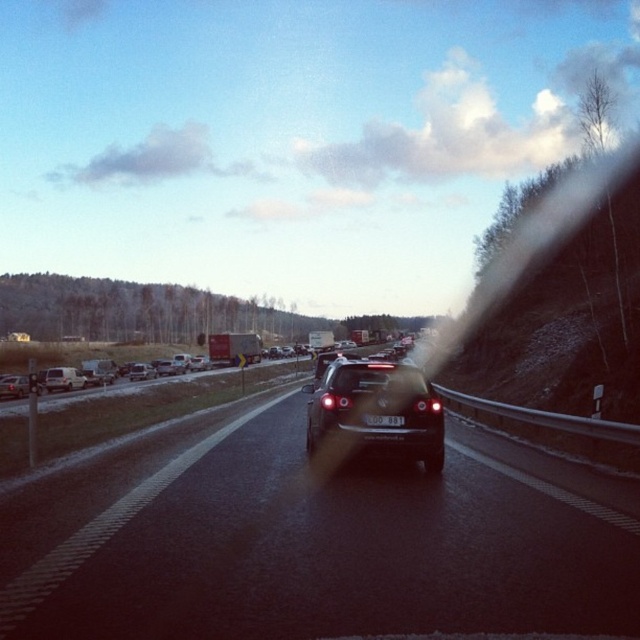
What is the color of the license plate located at point [384,420]?

The license plate at point [384,420] is black plastic.